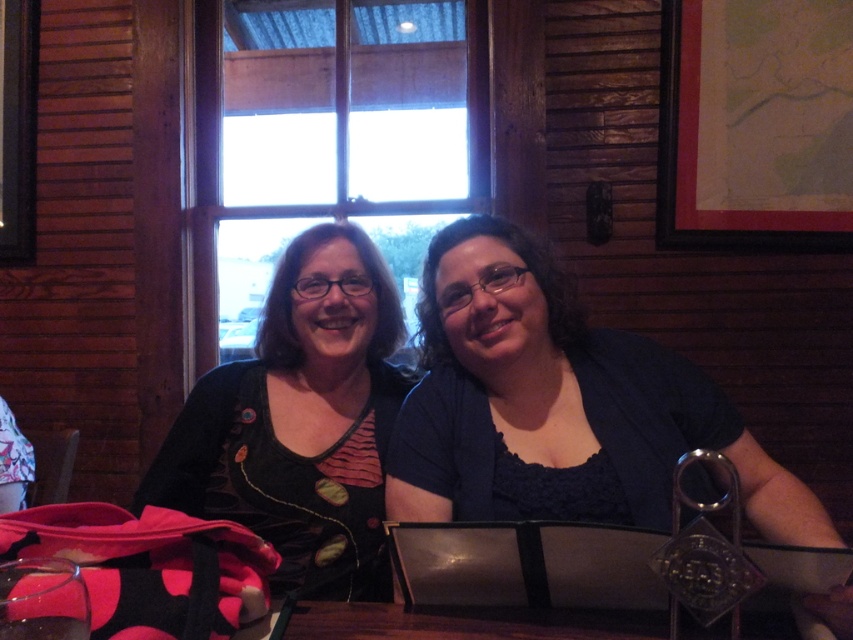
Is dark blue fabric shirt at center closer to camera compared to black velvet shirt at center?

That is True.

In the scene shown: Can you confirm if dark blue fabric shirt at center is positioned to the left of black velvet shirt at center?

Incorrect, dark blue fabric shirt at center is not on the left side of black velvet shirt at center.

Which is in front, point (460, 288) or point (204, 378)?

Point (460, 288)

The height and width of the screenshot is (640, 853). I want to click on dark blue fabric shirt at center, so click(560, 404).

Does black velvet shirt at center have a larger size compared to transparent glass at lower left?

Indeed, black velvet shirt at center has a larger size compared to transparent glass at lower left.

Does black velvet shirt at center appear under transparent glass at lower left?

Incorrect, black velvet shirt at center is not positioned below transparent glass at lower left.

Locate an element on the screen. This screenshot has height=640, width=853. black velvet shirt at center is located at coordinates (300, 420).

Between dark blue fabric shirt at center and transparent glass at lower left, which one appears on the right side from the viewer's perspective?

dark blue fabric shirt at center

Can you confirm if dark blue fabric shirt at center is positioned below transparent glass at lower left?

Actually, dark blue fabric shirt at center is above transparent glass at lower left.

Is point (659, 426) positioned before point (62, 582)?

No, it is behind (62, 582).

Find the location of `dark blue fabric shirt at center`. dark blue fabric shirt at center is located at coordinates (560, 404).